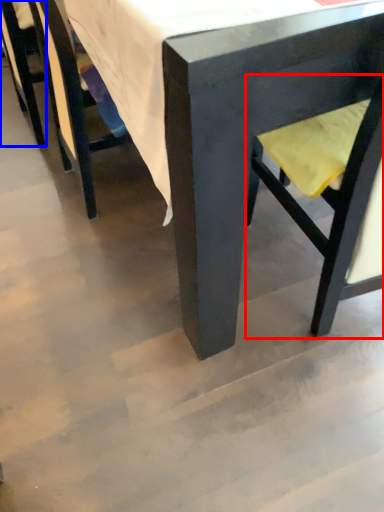
Question: Which of the following is the farthest to the observer, swivel chair (highlighted by a red box) or chair (highlighted by a blue box)?

Choices:
 (A) swivel chair
 (B) chair

Answer: (B)